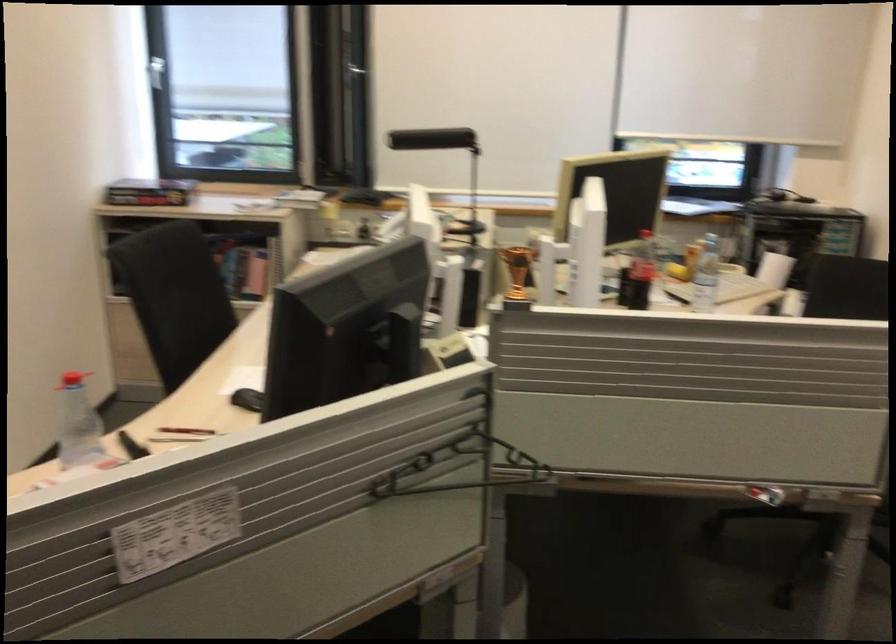
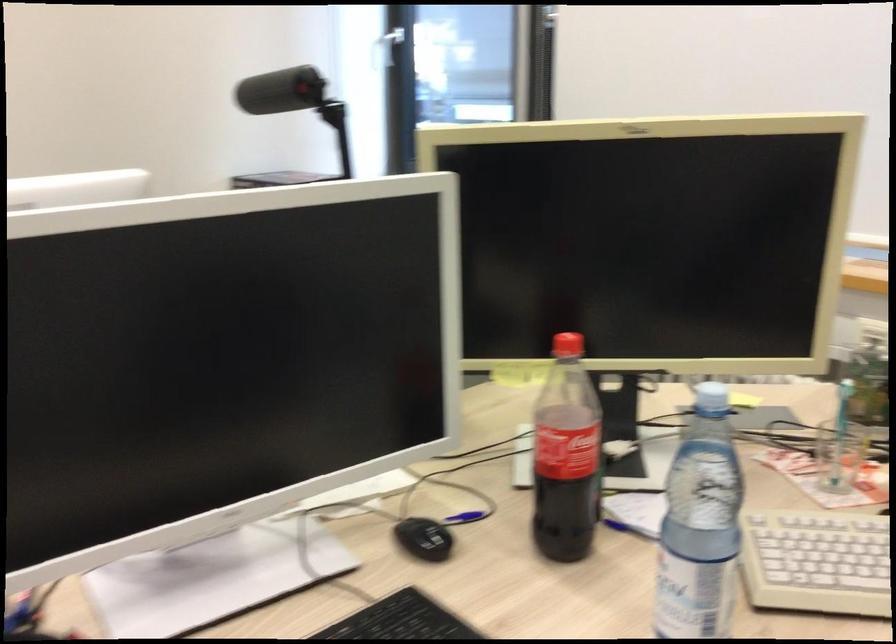
Find the pixel in the second image that matches (x=659, y=266) in the first image.

(839, 456)